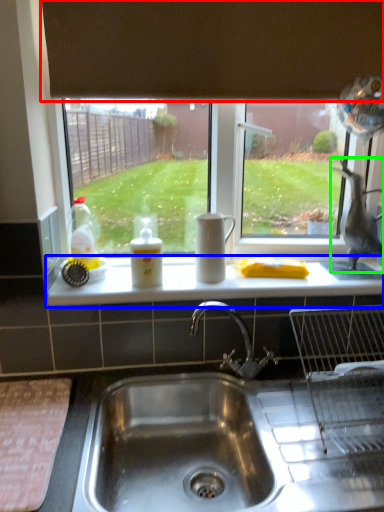
Question: Estimate the real-world distances between objects in this image. Which object is farther from exhaust hood (highlighted by a red box), counter top (highlighted by a blue box) or animal (highlighted by a green box)?

Choices:
 (A) counter top
 (B) animal

Answer: (A)